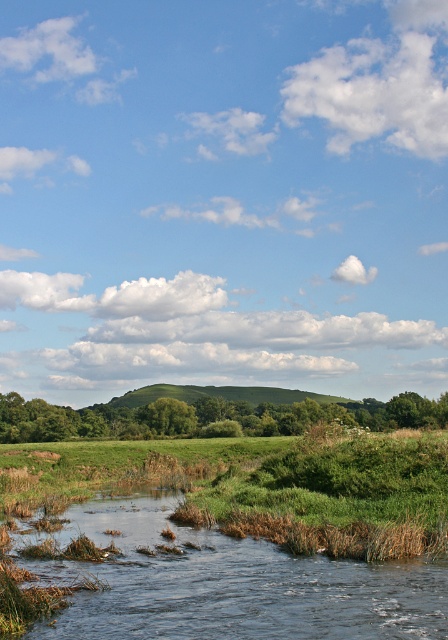
You are standing at the edge of the clear water at lower left and want to walk to the green leafy hill at center. Based on the scene description, which direction should you head to reach the hill?

The clear water at lower left is in front of green leafy hill at center, so to reach the hill, you should walk towards the back or away from the water since the hill is behind the water from your current position.

You are standing at the center of the image. Which direction should you move to reach the clear water at lower left?

The clear water at lower left is located at point [224,582] in 2D coordinates, so you should move towards the lower left direction to reach it.